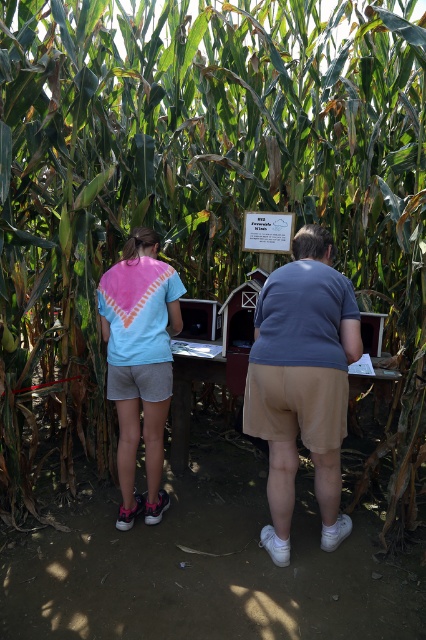
Question: Among these objects, which one is farthest from the camera?

Choices:
 (A) matte blue shirt at center
 (B) pink tie-dye t-shirt at center

Answer: (B)

Question: Is matte blue shirt at center to the right of pink tie-dye t-shirt at center from the viewer's perspective?

Choices:
 (A) yes
 (B) no

Answer: (A)

Question: Does matte blue shirt at center have a smaller size compared to pink tie-dye t-shirt at center?

Choices:
 (A) yes
 (B) no

Answer: (B)

Question: Which point is farther from the camera taking this photo?

Choices:
 (A) (282, 356)
 (B) (149, 308)

Answer: (B)

Question: Can you confirm if matte blue shirt at center is positioned below pink tie-dye t-shirt at center?

Choices:
 (A) yes
 (B) no

Answer: (A)

Question: Among these points, which one is nearest to the camera?

Choices:
 (A) (150, 376)
 (B) (276, 355)

Answer: (B)